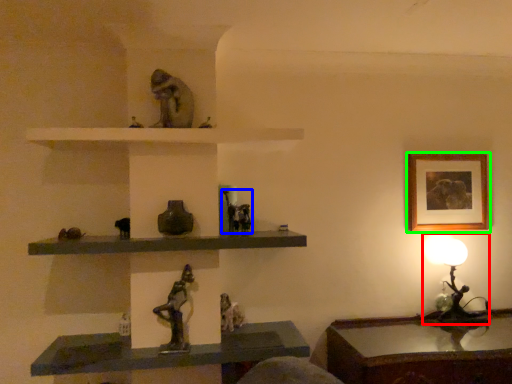
Question: Estimate the real-world distances between objects in this image. Which object is farther from table lamp (highlighted by a red box), animal (highlighted by a blue box) or picture frame (highlighted by a green box)?

Choices:
 (A) animal
 (B) picture frame

Answer: (A)